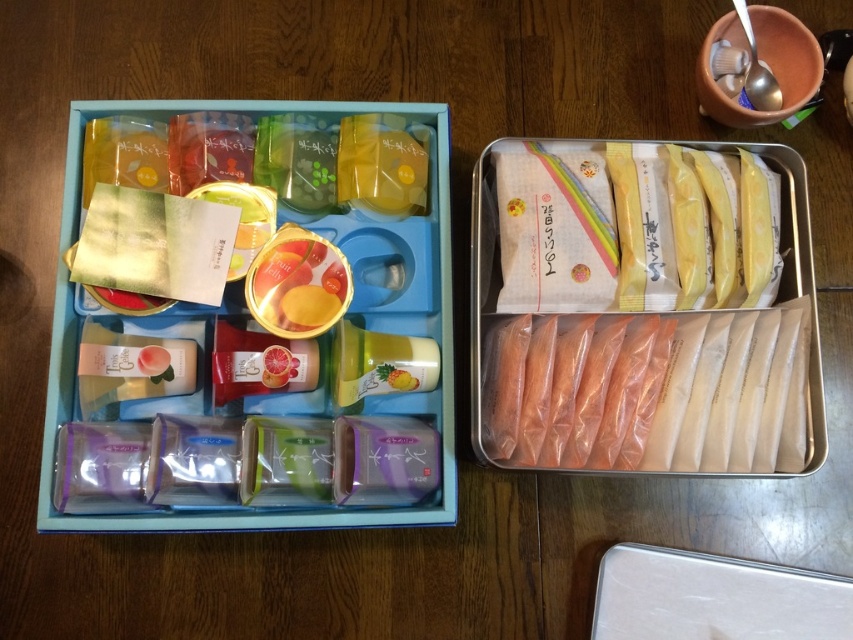
Question: Is translucent plastic bag at center behind matte plastic lunch box at center?

Choices:
 (A) no
 (B) yes

Answer: (B)

Question: Which point is farther to the camera?

Choices:
 (A) golden glossy jar at center
 (B) matte plastic lunch box at center
 (C) translucent plastic bag at center

Answer: (A)

Question: Which object appears closest to the camera in this image?

Choices:
 (A) translucent plastic bag at center
 (B) golden glossy jar at center

Answer: (A)

Question: Does translucent plastic bag at center have a greater width compared to matte plastic lunch box at center?

Choices:
 (A) no
 (B) yes

Answer: (A)

Question: Which of these objects is positioned farthest from the translucent plastic bag at center?

Choices:
 (A) matte plastic lunch box at center
 (B) golden glossy jar at center

Answer: (B)

Question: Does translucent plastic bag at center come in front of matte plastic lunch box at center?

Choices:
 (A) no
 (B) yes

Answer: (A)